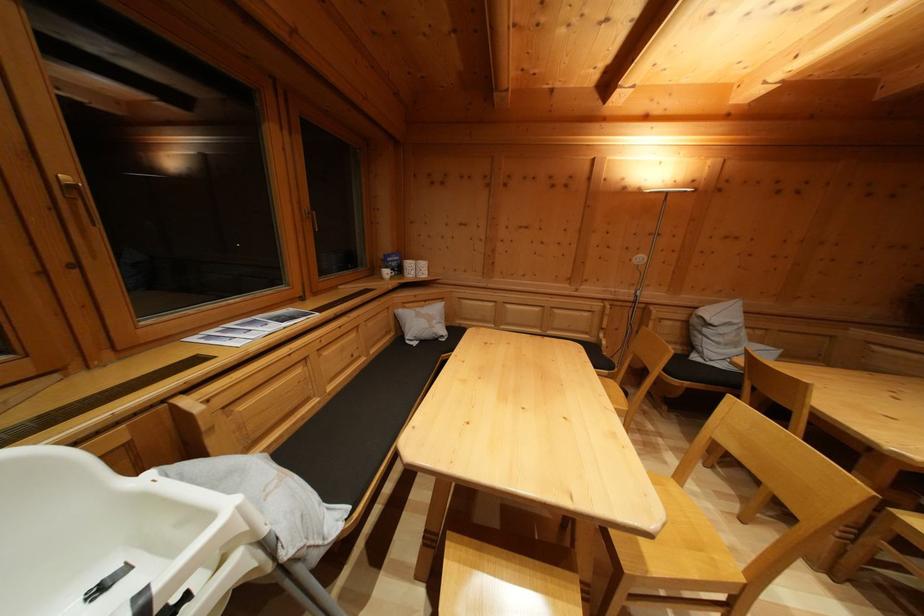
Find the location of a particular element. The image size is (924, 616). chair sitting surface is located at coordinates (675, 549).